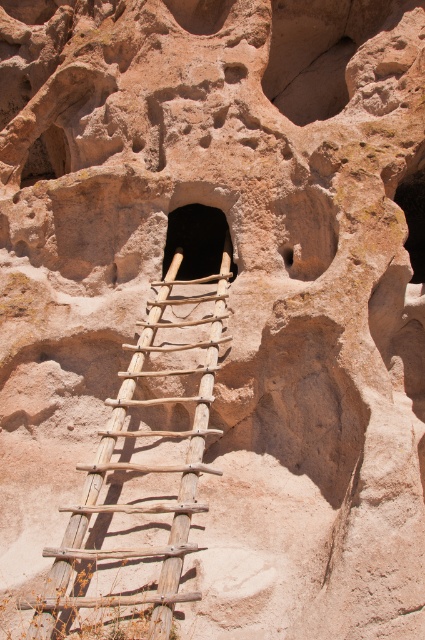
Which is in front, point (308, 92) or point (422, 198)?

Point (422, 198)

How far apart are smooth sandstone hole at upper center and smooth rock hole at right?

They are 16.68 meters apart.

Who is more forward, (299, 118) or (402, 189)?

Point (402, 189)

Where is `smooth sandstone hole at upper center`? The image size is (425, 640). smooth sandstone hole at upper center is located at coordinates (317, 86).

Can you confirm if smooth sandstone hole at center is positioned above smooth sandstone hole at upper center?

No.

Find the location of a particular element. The width and height of the screenshot is (425, 640). smooth sandstone hole at center is located at coordinates (306, 230).

Is brown wooden hole at center shorter than smooth rock cave at upper left?

Correct, brown wooden hole at center is not as tall as smooth rock cave at upper left.

Which is in front, point (206, 216) or point (37, 164)?

Positioned in front is point (206, 216).

You are a GUI agent. You are given a task and a screenshot of the screen. Output one action in this format:
    pyautogui.click(x=<x>, y=<y>)
    Task: Click on the brown wooden hole at center
    The width and height of the screenshot is (425, 640).
    Given the screenshot: What is the action you would take?
    pyautogui.click(x=195, y=240)